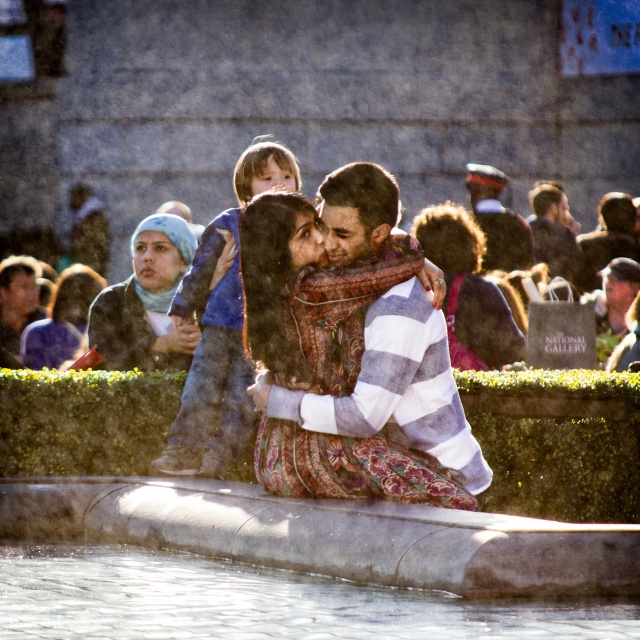
In the scene shown: You are a photographer at the scene and want to capture a photo where both the blue denim jeans at center and the floral dress at center are clearly visible. Given their height difference, which object should you focus on to ensure both are in frame?

The blue denim jeans at center is much taller than the floral dress at center, so focusing on the blue denim jeans at center will ensure both are in frame as it is the taller object.

Please describe the position of the blue denim jeans at center in the image using the coordinate system provided. What are their exact coordinates?

The blue denim jeans at center are located at the coordinates point (211,358).

You are a photographer standing at the camera position. You want to take a closeup shot of the gray stone fountain at center. Considering the distance, do you think you need a zoom lens?

The gray stone fountain at center is 55.13 meters from the camera. Therefore, to capture a closeup shot, you would need a zoom lens capable of reaching at least 55 meters to ensure clarity and focus on the fountain.